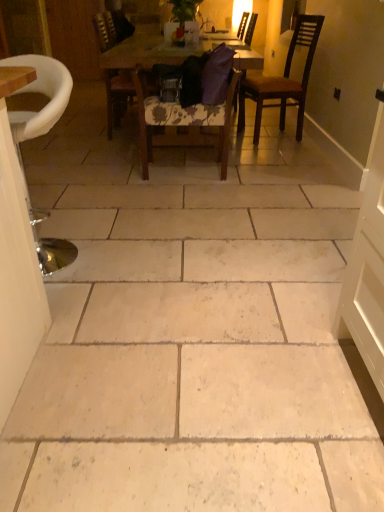
This screenshot has height=512, width=384. I want to click on vacant space to the left of floral fabric chair at center, the 2th chair viewed from the front, so click(x=108, y=174).